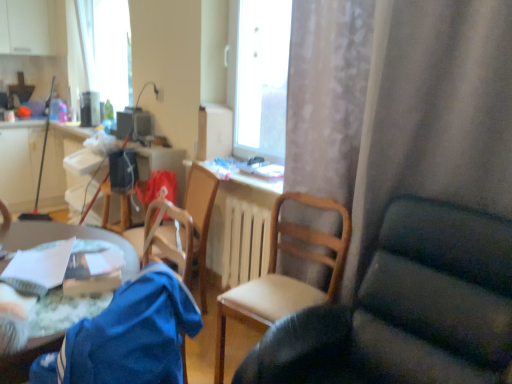
Question: In the image, is wooden chair at center positioned in front of or behind matte plastic computer desk at left?

Choices:
 (A) front
 (B) behind

Answer: (A)

Question: Is wooden chair at center taller or shorter than matte plastic computer desk at left?

Choices:
 (A) tall
 (B) short

Answer: (B)

Question: Estimate the real-world distances between objects in this image. Which object is farther from the wooden chair at center, marked as the second chair in a right-to-left arrangement?

Choices:
 (A) matte plastic computer desk at left
 (B) wooden chair at center, which is the third chair from left to right
 (C) wooden chair at center
 (D) green fabric table at lower left
 (E) wooden radiator at center

Answer: (A)

Question: Which object is positioned closest to the wooden chair at center, arranged as the first chair when viewed from the right?

Choices:
 (A) wooden chair at center
 (B) matte plastic computer desk at left
 (C) green fabric table at lower left
 (D) wooden radiator at center
 (E) wooden chair at center, the 2th chair from the left

Answer: (E)